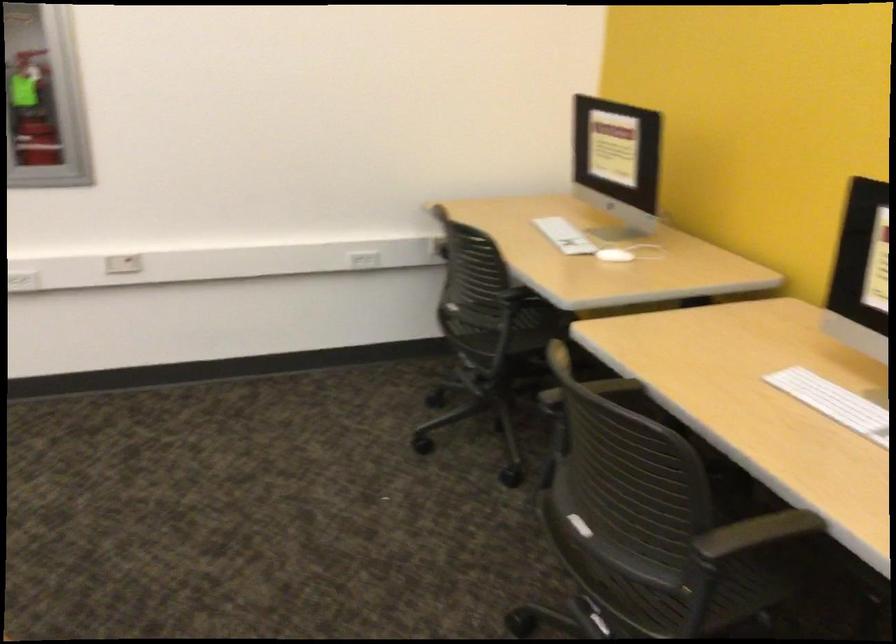
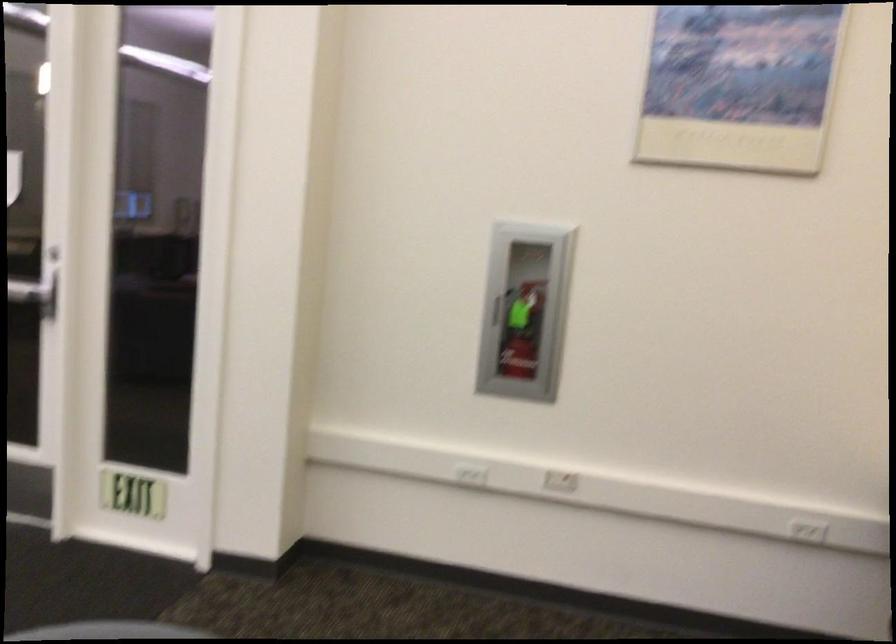
Question: How did the camera likely rotate?

Choices:
 (A) Left
 (B) Right
 (C) Up
 (D) Down

Answer: (A)